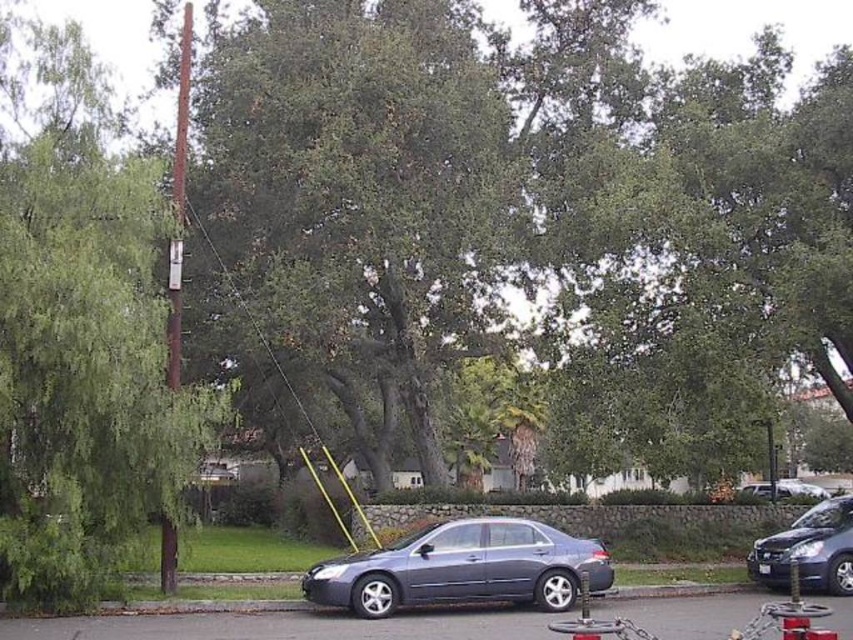
Does matte black sedan at right appear on the right side of brown wooden telegraph pole at left?

Correct, you'll find matte black sedan at right to the right of brown wooden telegraph pole at left.

Which of these two, matte black sedan at right or brown wooden telegraph pole at left, stands shorter?

matte black sedan at right is shorter.

Between point (846, 584) and point (172, 337), which one is positioned behind?

Positioned behind is point (172, 337).

Find the location of a particular element. This screenshot has width=853, height=640. matte black sedan at right is located at coordinates (808, 548).

Is green leafy tree at upper center to the right of metallic silver sedan at center from the viewer's perspective?

Incorrect, green leafy tree at upper center is not on the right side of metallic silver sedan at center.

Does green leafy tree at upper center have a greater width compared to metallic silver sedan at center?

Incorrect, green leafy tree at upper center's width does not surpass metallic silver sedan at center's.

Is point (276, 358) positioned before point (817, 490)?

Yes, point (276, 358) is closer to viewer.

At what (x,y) coordinates should I click in order to perform the action: click on green leafy tree at upper center. Please return your answer as a coordinate pair (x, y). This screenshot has height=640, width=853. Looking at the image, I should click on (282, 372).

Who is lower down, green leafy tree at left or green leafy tree at upper center?

Positioned lower is green leafy tree at upper center.

You are a GUI agent. You are given a task and a screenshot of the screen. Output one action in this format:
    pyautogui.click(x=<x>, y=<y>)
    Task: Click on the green leafy tree at left
    This screenshot has height=640, width=853.
    Given the screenshot: What is the action you would take?
    pyautogui.click(x=82, y=333)